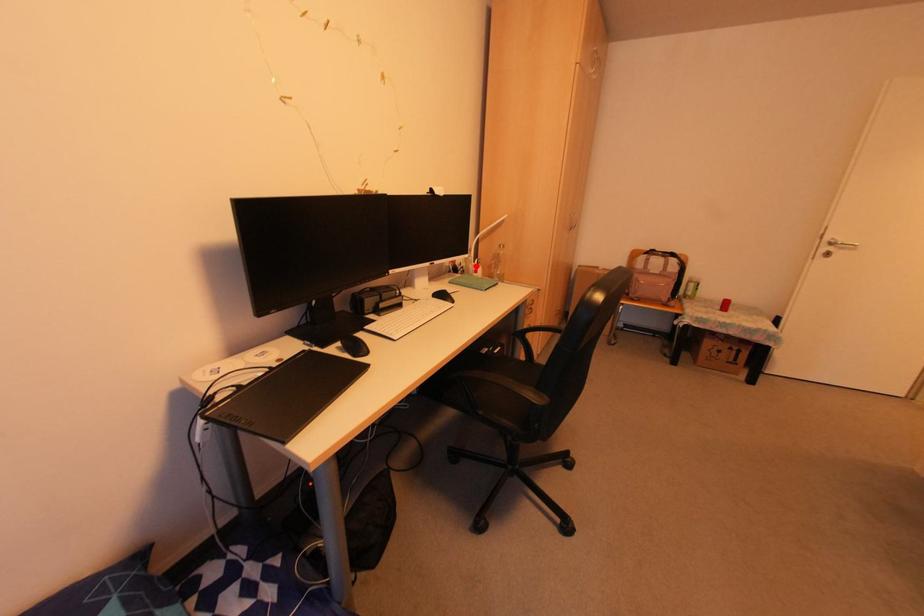
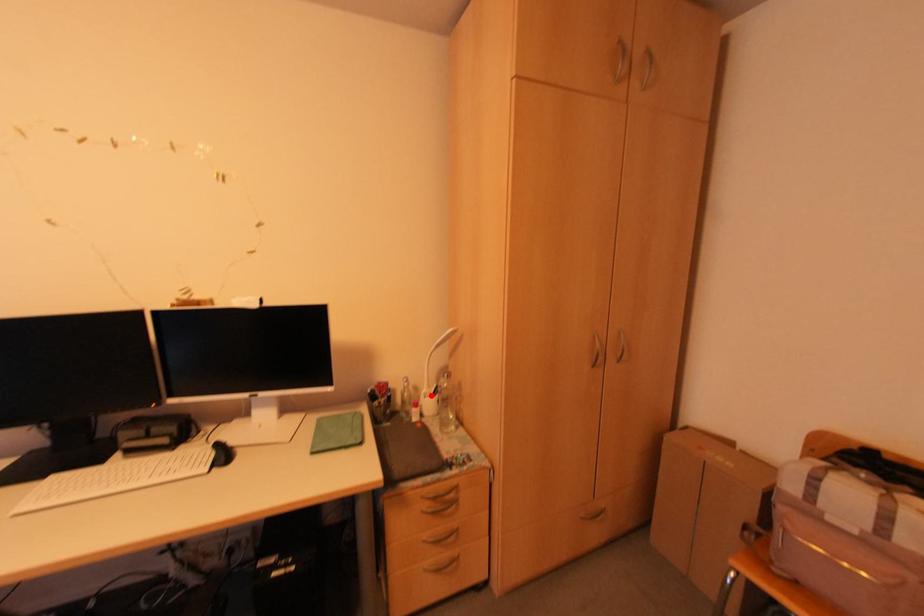
I am providing you with two images of the same scene from different viewpoints. A red point is marked on the first image and another point is marked on the second image. Does the point marked in image1 correspond to the same location as the one in image2?

Yes